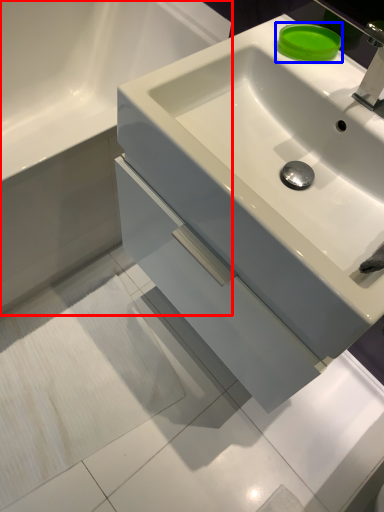
Question: Which of the following is the closest to the observer, bathroom cabinet (highlighted by a red box) or soap (highlighted by a blue box)?

Choices:
 (A) bathroom cabinet
 (B) soap

Answer: (A)